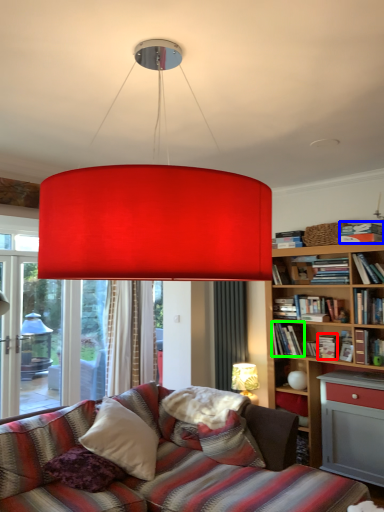
Question: Which is nearer to the book (highlighted by a red box)? book (highlighted by a blue box) or book (highlighted by a green box).

Choices:
 (A) book
 (B) book

Answer: (B)